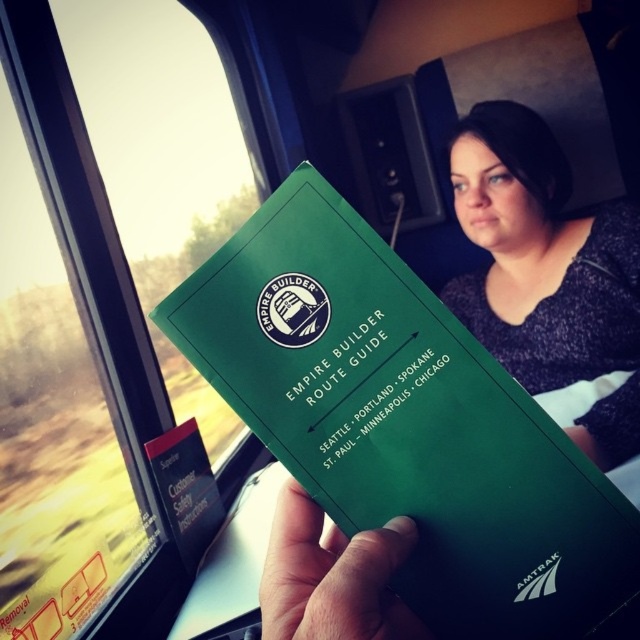
You are standing in the train car and want to move from the point at coordinates point [84,509] to the point at coordinates point [396,582]. Can you walk directly between them without any obstacles?

Point [84,509] is behind point [396,582], so you can walk directly between them without any obstacles.

You are a passenger on the Empire Builder train and want to place a small item on the seat next to you. The seat is located at point coordinates of (403, 420). There is a green paper at center. Can you place the item on the seat without it overlapping the green paper at center?

The point coordinates of (403, 420) corresponds to the green paper at center, so placing the item there would overlap with the green paper at center. Choose another spot on the seat.